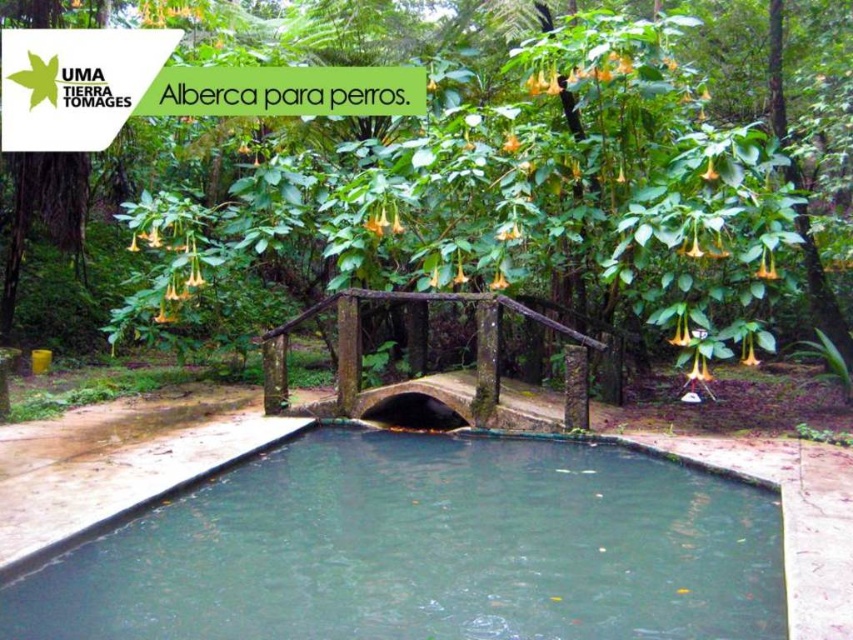
Question: Does clear water at center have a greater width compared to green leafy tree at center?

Choices:
 (A) no
 (B) yes

Answer: (B)

Question: Which object appears closest to the camera in this image?

Choices:
 (A) clear water at center
 (B) green leafy tree at center

Answer: (A)

Question: Can you confirm if clear water at center is positioned to the right of green leafy tree at center?

Choices:
 (A) yes
 (B) no

Answer: (B)

Question: Does clear water at center have a greater width compared to green leafy tree at center?

Choices:
 (A) yes
 (B) no

Answer: (A)